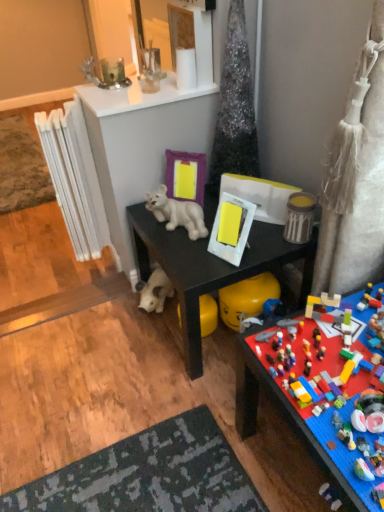
This screenshot has height=512, width=384. Find the location of `free point below white plastic radiator at left (from a real-world perspective)`. free point below white plastic radiator at left (from a real-world perspective) is located at coordinates (99, 256).